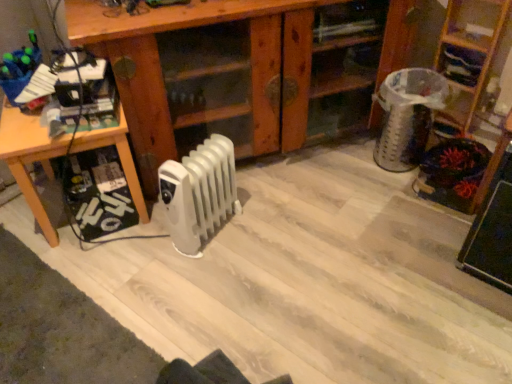
Question: Considering the relative positions of wooden table at left and wooden bookshelf at upper right, which is counted as the second shelf, starting from the right, in the image provided, is wooden table at left to the right of wooden bookshelf at upper right, which is counted as the second shelf, starting from the right, from the viewer's perspective?

Choices:
 (A) yes
 (B) no

Answer: (B)

Question: Would you say wooden table at left contains wooden bookshelf at upper right, which is counted as the second shelf, starting from the right?

Choices:
 (A) no
 (B) yes

Answer: (A)

Question: Can we say wooden table at left lies outside wooden bookshelf at upper right, which ranks as the second shelf in left-to-right order?

Choices:
 (A) yes
 (B) no

Answer: (A)

Question: Considering the relative sizes of wooden table at left and wooden bookshelf at upper right, which is counted as the second shelf, starting from the right, in the image provided, is wooden table at left smaller than wooden bookshelf at upper right, which is counted as the second shelf, starting from the right,?

Choices:
 (A) no
 (B) yes

Answer: (A)

Question: Does wooden table at left have a lesser height compared to wooden bookshelf at upper right, which ranks as the second shelf in left-to-right order?

Choices:
 (A) yes
 (B) no

Answer: (B)

Question: Considering the relative positions of wooden bookshelf at upper right, the third shelf from the left, and white plastic radiator at center in the image provided, is wooden bookshelf at upper right, the third shelf from the left, to the left or to the right of white plastic radiator at center?

Choices:
 (A) right
 (B) left

Answer: (A)

Question: Considering the positions of wooden bookshelf at upper right, the first shelf from the right, and white plastic radiator at center in the image, is wooden bookshelf at upper right, the first shelf from the right, taller or shorter than white plastic radiator at center?

Choices:
 (A) short
 (B) tall

Answer: (B)

Question: From a real-world perspective, relative to white plastic radiator at center, is wooden bookshelf at upper right, the third shelf from the left, vertically above or below?

Choices:
 (A) above
 (B) below

Answer: (A)

Question: Relative to white plastic radiator at center, is wooden bookshelf at upper right, the first shelf from the right, in front or behind?

Choices:
 (A) behind
 (B) front

Answer: (A)

Question: Looking at the image, does wooden table at left seem bigger or smaller compared to wooden bookshelf at upper right, the third shelf from the left?

Choices:
 (A) big
 (B) small

Answer: (A)

Question: Is point (130, 167) closer or farther from the camera than point (437, 51)?

Choices:
 (A) farther
 (B) closer

Answer: (B)

Question: Would you say wooden table at left is inside or outside wooden bookshelf at upper right, the first shelf from the right?

Choices:
 (A) inside
 (B) outside

Answer: (B)

Question: Based on their positions, is wooden table at left located to the left or right of wooden bookshelf at upper right, the third shelf from the left?

Choices:
 (A) right
 (B) left

Answer: (B)

Question: Considering the positions of wooden table at left and wooden cabinet at center, acting as the 1th shelf starting from the left, in the image, is wooden table at left wider or thinner than wooden cabinet at center, acting as the 1th shelf starting from the left,?

Choices:
 (A) wide
 (B) thin

Answer: (B)

Question: Is point (47, 162) closer or farther from the camera than point (315, 97)?

Choices:
 (A) closer
 (B) farther

Answer: (A)